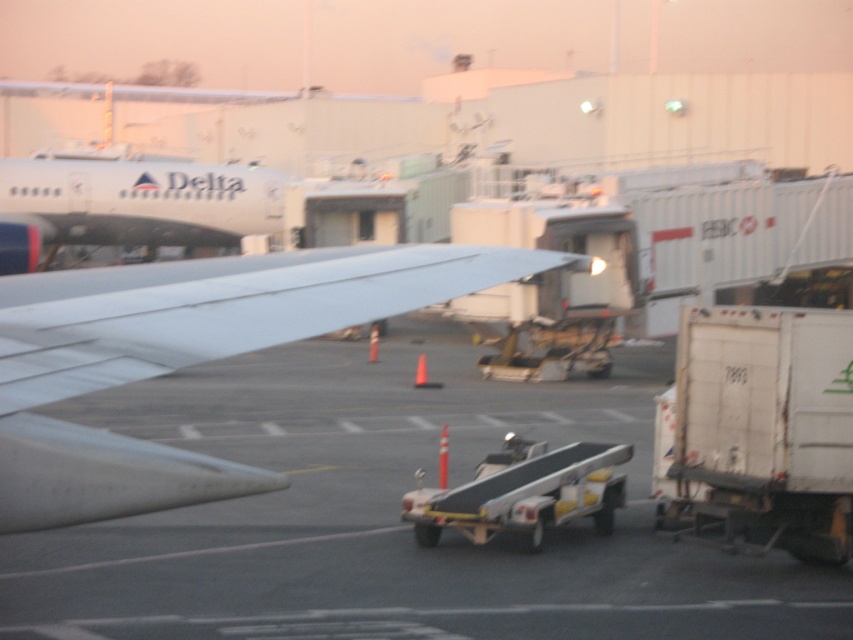
Consider the image. Is smooth asphalt tarmac at center bigger than silver metallic wing at center?

Yes, smooth asphalt tarmac at center is bigger than silver metallic wing at center.

Can you confirm if smooth asphalt tarmac at center is taller than silver metallic wing at center?

Yes, smooth asphalt tarmac at center is taller than silver metallic wing at center.

Between point (279, 353) and point (108, 353), which one is positioned behind?

The point (279, 353) is behind.

Find the location of `smooth asphalt tarmac at center`. smooth asphalt tarmac at center is located at coordinates (389, 516).

Can you confirm if silver metallic wing at center is taller than white matte truck at right?

In fact, silver metallic wing at center may be shorter than white matte truck at right.

Is silver metallic wing at center thinner than white matte truck at right?

Incorrect, silver metallic wing at center's width is not less than white matte truck at right's.

Locate an element on the screen. The height and width of the screenshot is (640, 853). silver metallic wing at center is located at coordinates (186, 356).

Between point (102, 595) and point (166, 177), which one is positioned behind?

Point (166, 177)

Is smooth asphalt tarmac at center shorter than matte white airplane at upper left?

Correct, smooth asphalt tarmac at center is not as tall as matte white airplane at upper left.

This screenshot has width=853, height=640. I want to click on smooth asphalt tarmac at center, so click(x=389, y=516).

The height and width of the screenshot is (640, 853). I want to click on smooth asphalt tarmac at center, so click(389, 516).